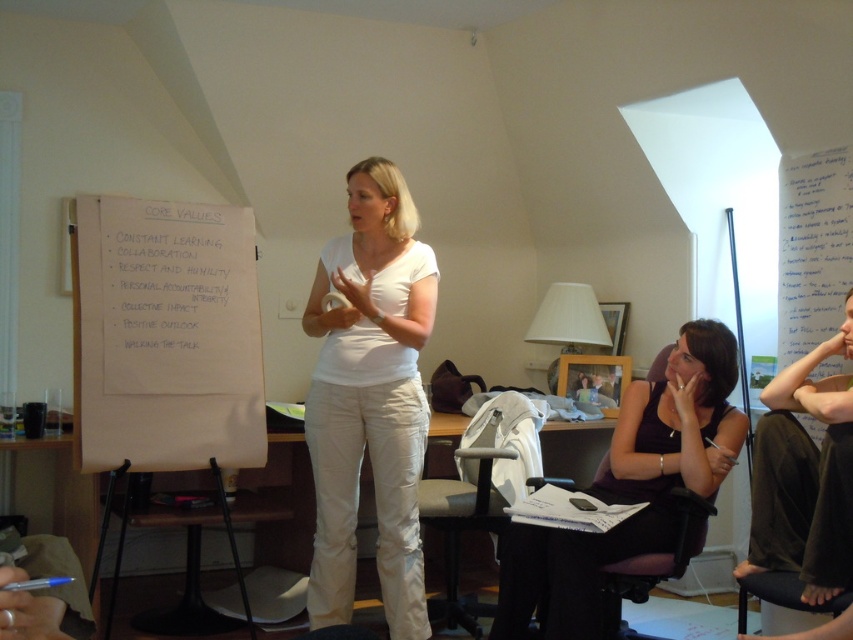
You are a photographer standing at the entrance of the room. You want to take a picture of the white cotton shirt at center. Where should you position your camera to capture the shirt in the frame?

To capture the white cotton shirt at center, position the camera so that it is aligned with the coordinates point (370, 400), which is the 2D location of the shirt in the scene.

You are standing in the room and want to reach the white paper at left. The room has a clearance of 2.5 meters. Is there enough space for you to move towards it?

The white paper at left is 2.77 meters from camera. The room has a clearance of 2.5 meters. Therefore, there is not enough space to move towards the white paper at left because the distance is greater than the clearance available.

You are organizing a photoshoot and need to ensure that the clothing items in the scene are appropriately sized for the models. Given that the white cotton shirt at center and the matte purple dress at lower right are part of the setup, which clothing item has a smaller width?

The white cotton shirt at center has a smaller width than the matte purple dress at lower right.